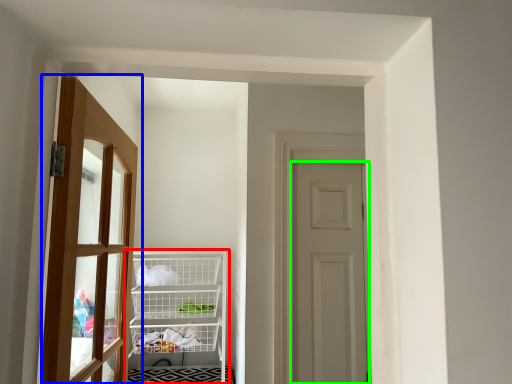
Question: Which object is positioned farthest from shelf (highlighted by a red box)? Select from door (highlighted by a blue box) and door (highlighted by a green box).

Choices:
 (A) door
 (B) door

Answer: (B)